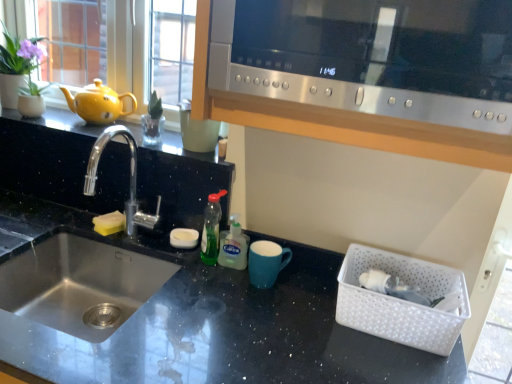
Identify the location of free location to the left of matte blue mug at center. (205, 273).